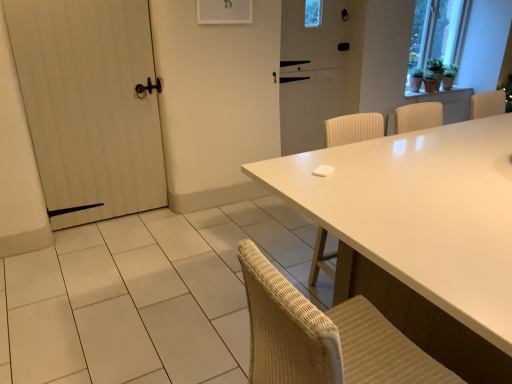
Question: From a real-world perspective, does white glossy table at center stand above white matte screen door at center?

Choices:
 (A) yes
 (B) no

Answer: (B)

Question: Considering the relative positions of white glossy table at center and white matte screen door at center in the image provided, is white glossy table at center to the right of white matte screen door at center from the viewer's perspective?

Choices:
 (A) yes
 (B) no

Answer: (A)

Question: Considering the relative sizes of white glossy table at center and white matte screen door at center in the image provided, is white glossy table at center shorter than white matte screen door at center?

Choices:
 (A) no
 (B) yes

Answer: (B)

Question: Considering the relative sizes of white glossy table at center and white matte screen door at center in the image provided, is white glossy table at center bigger than white matte screen door at center?

Choices:
 (A) no
 (B) yes

Answer: (B)

Question: Considering the relative positions of white glossy table at center and white matte screen door at center in the image provided, is white glossy table at center behind white matte screen door at center?

Choices:
 (A) yes
 (B) no

Answer: (B)

Question: In terms of width, does white wooden door at left look wider or thinner when compared to white matte screen door at center?

Choices:
 (A) wide
 (B) thin

Answer: (A)

Question: From the image's perspective, is white wooden door at left positioned above or below white matte screen door at center?

Choices:
 (A) above
 (B) below

Answer: (B)

Question: Considering their positions, is white wooden door at left located in front of or behind white matte screen door at center?

Choices:
 (A) behind
 (B) front

Answer: (B)

Question: From a real-world perspective, relative to white matte screen door at center, is white wooden door at left vertically above or below?

Choices:
 (A) below
 (B) above

Answer: (A)

Question: From a real-world perspective, is white glossy table at center physically located above or below green matte plant at upper right?

Choices:
 (A) above
 (B) below

Answer: (B)

Question: Is white glossy table at center wider or thinner than green matte plant at upper right?

Choices:
 (A) wide
 (B) thin

Answer: (A)

Question: Considering the positions of white glossy table at center and green matte plant at upper right in the image, is white glossy table at center bigger or smaller than green matte plant at upper right?

Choices:
 (A) big
 (B) small

Answer: (A)

Question: Considering the relative positions of white glossy table at center and green matte plant at upper right in the image provided, is white glossy table at center to the left or to the right of green matte plant at upper right?

Choices:
 (A) left
 (B) right

Answer: (A)

Question: Is white matte screen door at center inside the boundaries of white glossy table at center, or outside?

Choices:
 (A) outside
 (B) inside

Answer: (A)

Question: From a real-world perspective, is white matte screen door at center above or below white glossy table at center?

Choices:
 (A) above
 (B) below

Answer: (A)